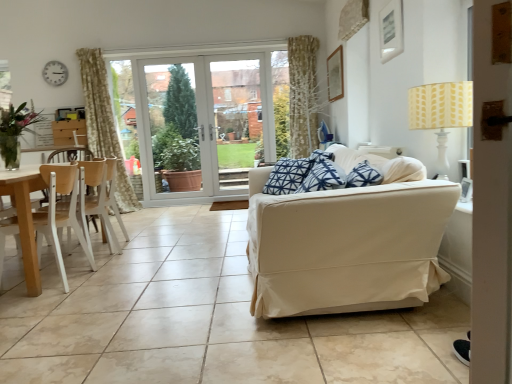
Image resolution: width=512 pixels, height=384 pixels. Identify the location of free location in front of light wood/wooden chair at left, positioned as the 1th chair in front-to-back order. 37,304.